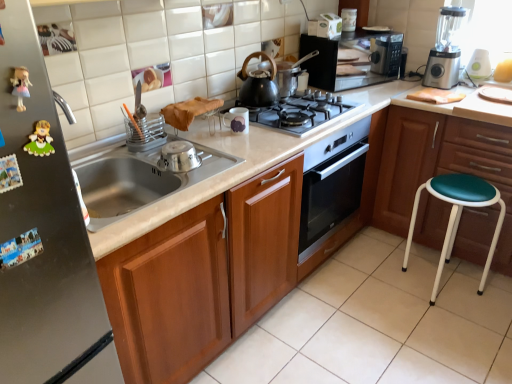
Question: From their relative heights in the image, would you say green plastic blender at upper right, the first appliance viewed from the back, is taller or shorter than green leather stool at right?

Choices:
 (A) tall
 (B) short

Answer: (B)

Question: In the image, is green plastic blender at upper right, which ranks as the first appliance in top-to-bottom order, on the left side or the right side of green leather stool at right?

Choices:
 (A) left
 (B) right

Answer: (B)

Question: Which is nearer to the green plastic blender at upper right, marked as the 3th appliance in a left-to-right arrangement?

Choices:
 (A) white glossy countertop at center
 (B) black matte gas stove at center
 (C) plastic figurine at left
 (D) black matte microwave at upper right
 (E) green leather stool at right

Answer: (D)

Question: Estimate the real-world distances between objects in this image. Which object is closer to the black matte tea pot at center?

Choices:
 (A) white glossy countertop at center
 (B) teal vinyl stool at lower right
 (C) black matte gas stove at center
 (D) satin silver blender at upper right
 (E) satin silver fridge at left

Answer: (C)